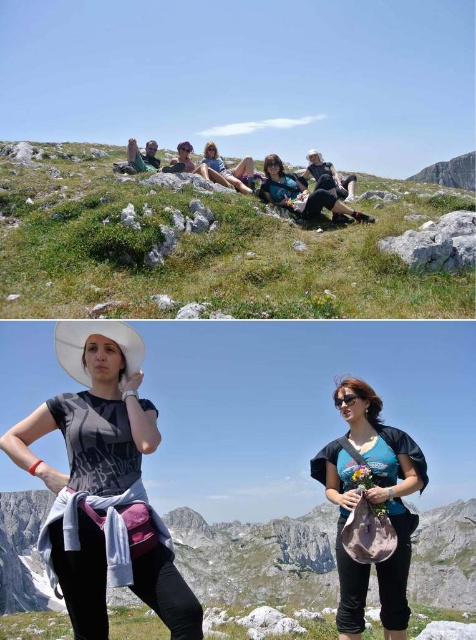
Between teal jersey at center and matte black shorts at center, which one appears on the right side from the viewer's perspective?

teal jersey at center is more to the right.

Is point (386, 602) more distant than point (241, 180)?

No, it is in front of (241, 180).

Between point (366, 394) and point (231, 173), which one is positioned in front?

Point (366, 394)

Find the location of a particular element. teal jersey at center is located at coordinates (372, 502).

How distant is rugged stone mountain at center from matte black shirt at center?

rugged stone mountain at center is 100.21 meters away from matte black shirt at center.

Is point (240, 525) positioned behind point (264, 172)?

That is True.

Where is `rugged stone mountain at center`? This screenshot has width=476, height=640. rugged stone mountain at center is located at coordinates (257, 557).

Is green grassy at lower center in front of matte black shorts at center?

Yes, it is in front of matte black shorts at center.

Is the position of green grassy at lower center more distant than that of matte black shorts at center?

No, green grassy at lower center is closer to the viewer.

Image resolution: width=476 pixels, height=640 pixels. Identify the location of green grassy at lower center. (35, 627).